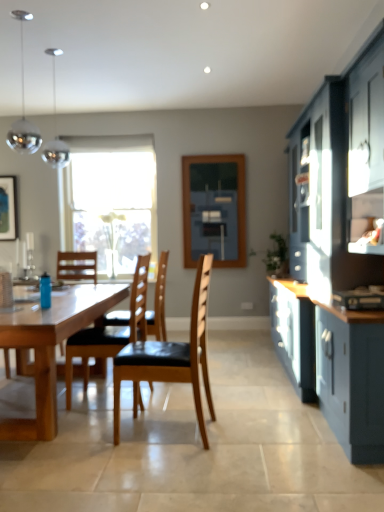
I want to click on vacant point to the right of blue matte water bottle at table left, so click(64, 305).